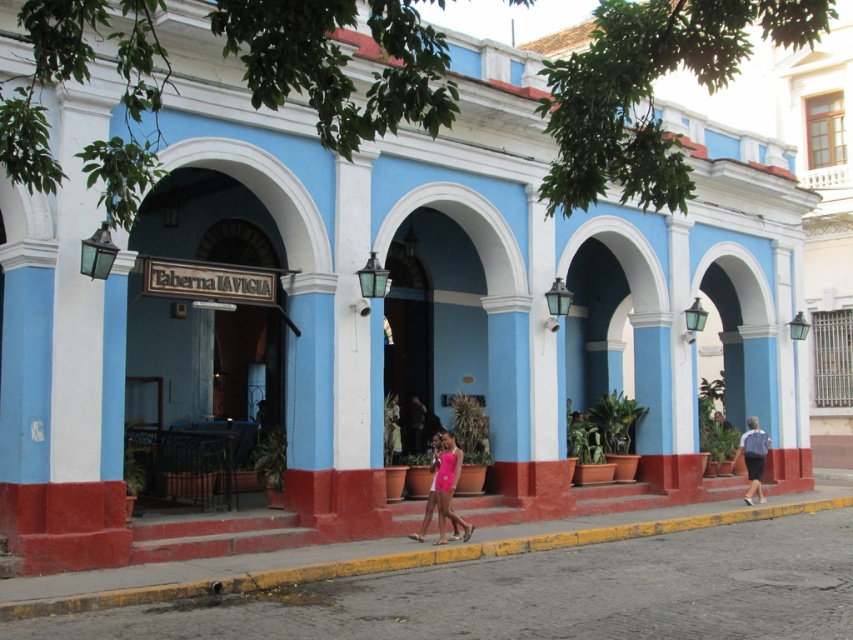
Question: Among these objects, which one is farthest from the camera?

Choices:
 (A) pink matte dress at center
 (B) light blue shirt at center

Answer: (B)

Question: In this image, where is yellow asphalt at lower center located relative to pink matte dress at center?

Choices:
 (A) left
 (B) right

Answer: (B)

Question: Is yellow asphalt at lower center closer to the viewer compared to pink matte dress at center?

Choices:
 (A) no
 (B) yes

Answer: (B)

Question: Does yellow asphalt at lower center come behind pink matte dress at center?

Choices:
 (A) yes
 (B) no

Answer: (B)

Question: Which object is the farthest from the light blue shirt at center?

Choices:
 (A) yellow asphalt at lower center
 (B) pink matte dress at center

Answer: (B)

Question: Which of the following is the farthest from the observer?

Choices:
 (A) (738, 445)
 (B) (422, 529)

Answer: (A)